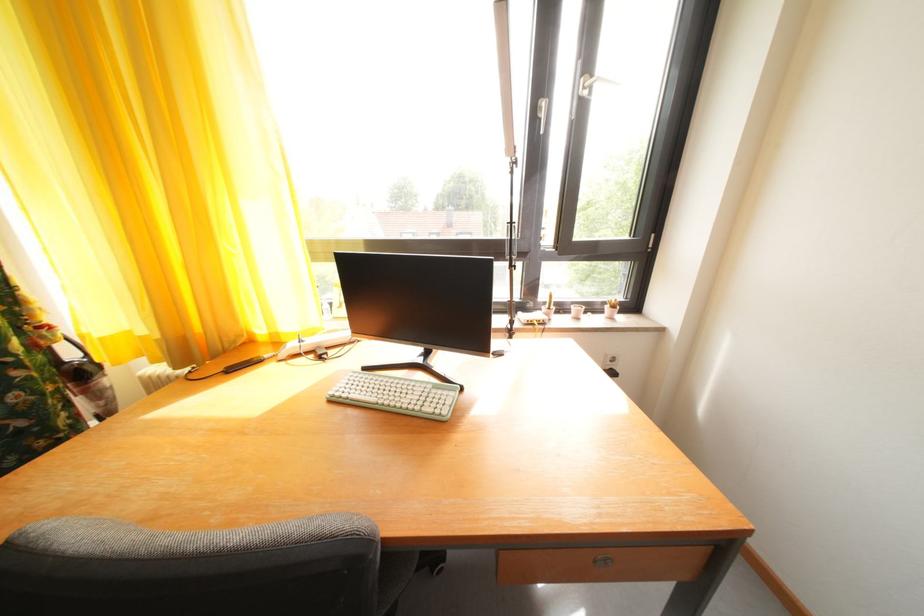
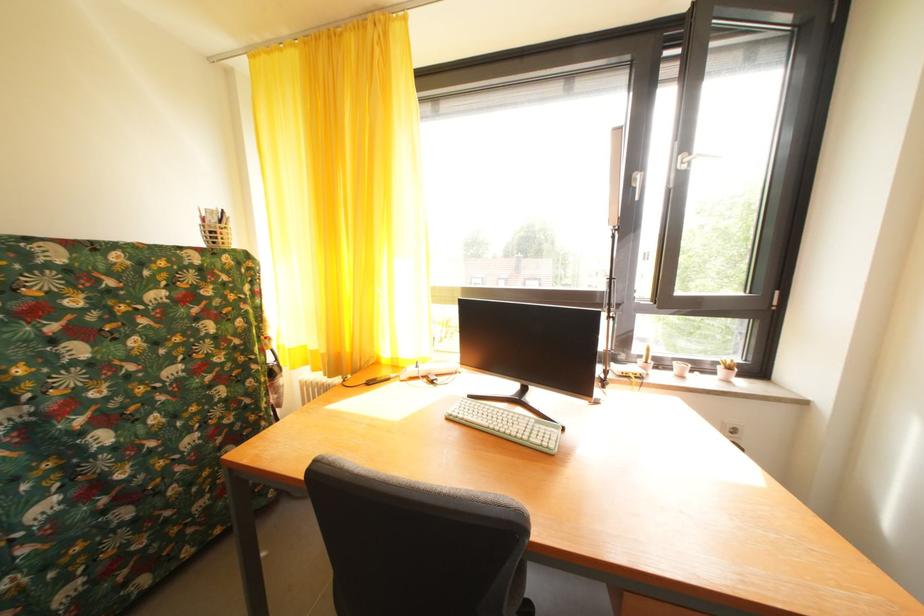
Locate, in the second image, the point that corresponds to (373,374) in the first image.

(479, 402)